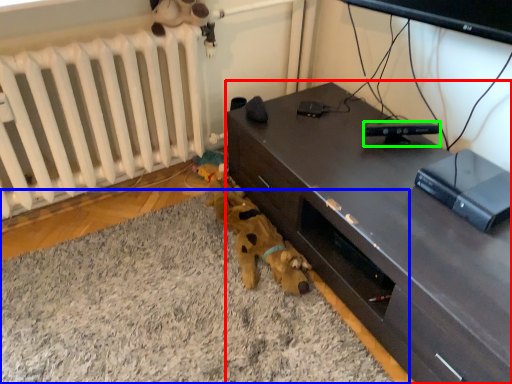
Question: Which object is positioned farthest from desk (highlighted by a red box)? Select from plain (highlighted by a blue box) and gadget (highlighted by a green box).

Choices:
 (A) plain
 (B) gadget

Answer: (A)